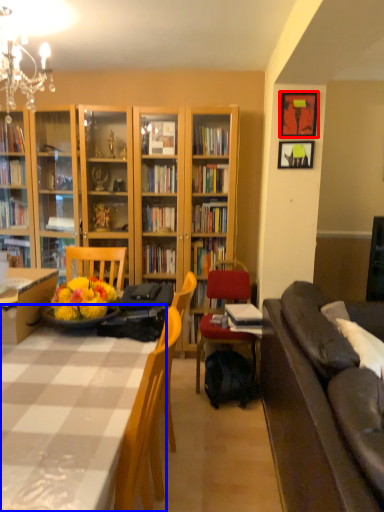
Question: Which object appears closest to the camera in this image, picture frame (highlighted by a red box) or table (highlighted by a blue box)?

Choices:
 (A) picture frame
 (B) table

Answer: (B)